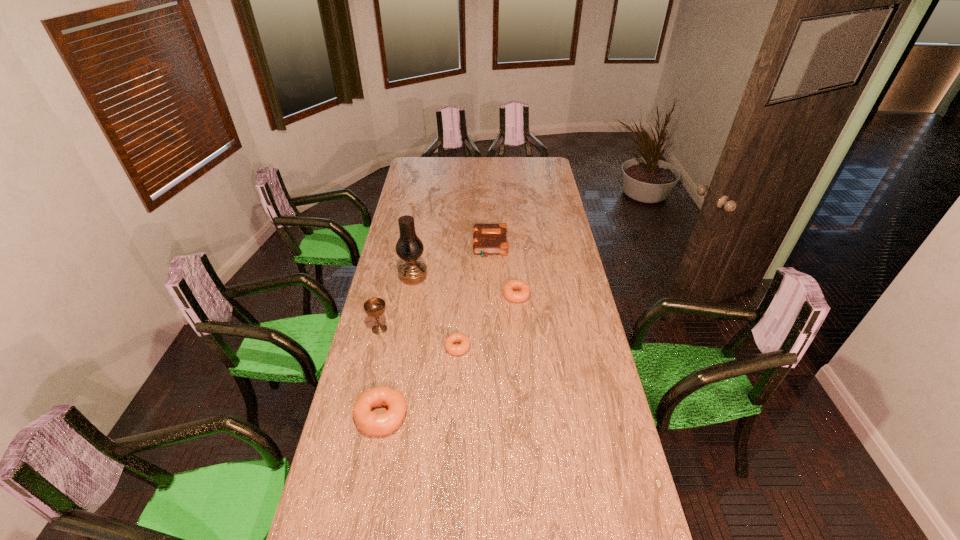
What are the coordinates of `blank region between the chalice and the tallest object` in the screenshot? It's located at click(396, 303).

Where is `vacant area that lies between the second doughnut from left to right and the farthest doughnut`? vacant area that lies between the second doughnut from left to right and the farthest doughnut is located at coordinates (487, 321).

The height and width of the screenshot is (540, 960). In order to click on unoccupied area between the fifth farthest object and the farthest object in this screenshot , I will do `click(473, 296)`.

Locate an element on the screen. Image resolution: width=960 pixels, height=540 pixels. free space that is in between the farthest object and the fifth farthest object is located at coordinates (473, 296).

Identify the location of the third closest object to the Bible. (452, 349).

Identify which object is the closest to the Bible. Please provide its 2D coordinates. Your answer should be formatted as a tuple, i.e. [(x, y)], where the tuple contains the x and y coordinates of a point satisfying the conditions above.

[(513, 284)]

At what (x,y) coordinates should I click in order to perform the action: click on doughnut that can be found as the closest to the farthest doughnut. Please return your answer as a coordinate pair (x, y). Looking at the image, I should click on (452, 349).

This screenshot has height=540, width=960. Identify the location of the second closest doughnut relative to the tallest object. point(513,284).

What are the coordinates of `vacant area that satisfies the following two spatial constraints: 1. on the spine side of the farthest object; 2. on the front side of the tallest object` in the screenshot? It's located at (491, 278).